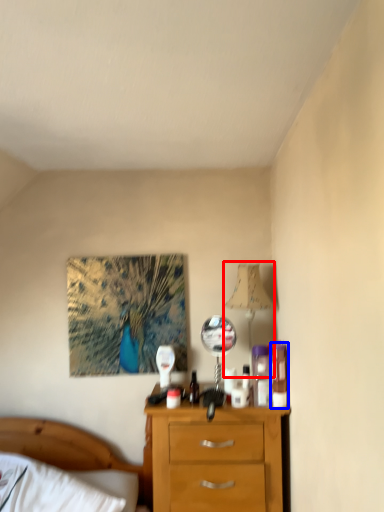
Question: Which object is further to the camera taking this photo, table lamp (highlighted by a red box) or toiletry (highlighted by a blue box)?

Choices:
 (A) table lamp
 (B) toiletry

Answer: (A)